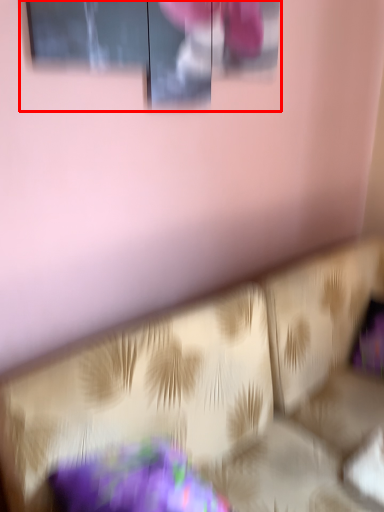
Question: From the image's perspective, considering the relative positions of window (annotated by the red box) and furniture in the image provided, where is window (annotated by the red box) located with respect to the staircase?

Choices:
 (A) below
 (B) above

Answer: (B)